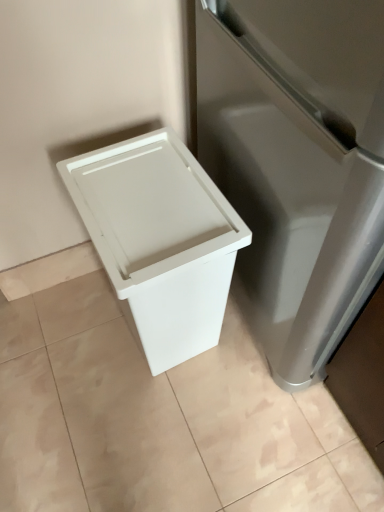
Question: From a real-world perspective, is white plastic trash can at lower left above or below white plastic waste bin at lower left?

Choices:
 (A) above
 (B) below

Answer: (B)

Question: In terms of size, does white plastic trash can at lower left appear bigger or smaller than white plastic waste bin at lower left?

Choices:
 (A) big
 (B) small

Answer: (B)

Question: Is white plastic trash can at lower left inside the boundaries of white plastic waste bin at lower left, or outside?

Choices:
 (A) inside
 (B) outside

Answer: (B)

Question: Considering the relative positions of white plastic waste bin at lower left and white plastic trash can at lower left in the image provided, is white plastic waste bin at lower left to the left or to the right of white plastic trash can at lower left?

Choices:
 (A) right
 (B) left

Answer: (A)

Question: Relative to white plastic trash can at lower left, is white plastic waste bin at lower left in front or behind?

Choices:
 (A) behind
 (B) front

Answer: (B)

Question: Considering the positions of white plastic waste bin at lower left and white plastic trash can at lower left in the image, is white plastic waste bin at lower left taller or shorter than white plastic trash can at lower left?

Choices:
 (A) short
 (B) tall

Answer: (B)

Question: In terms of size, does white plastic waste bin at lower left appear bigger or smaller than white plastic trash can at lower left?

Choices:
 (A) small
 (B) big

Answer: (B)